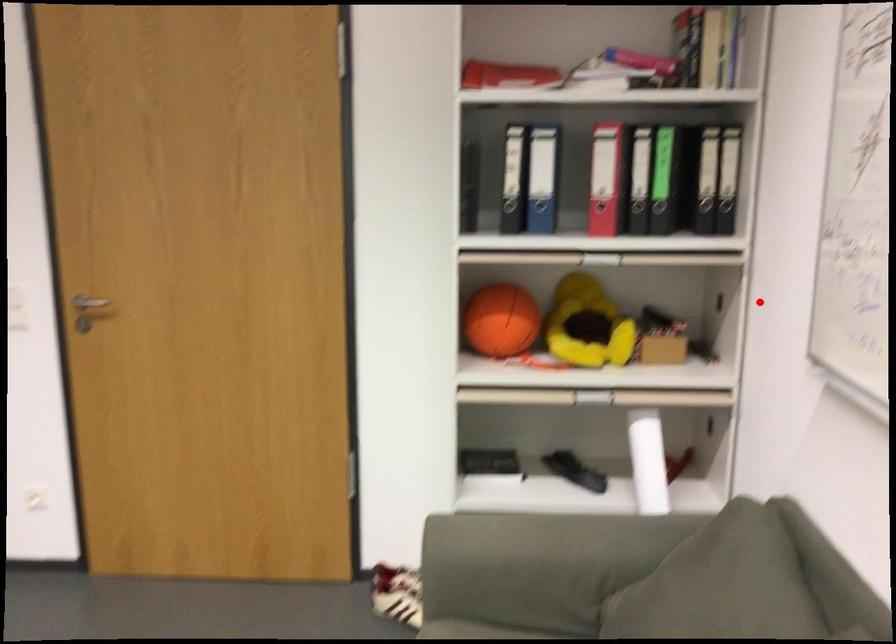
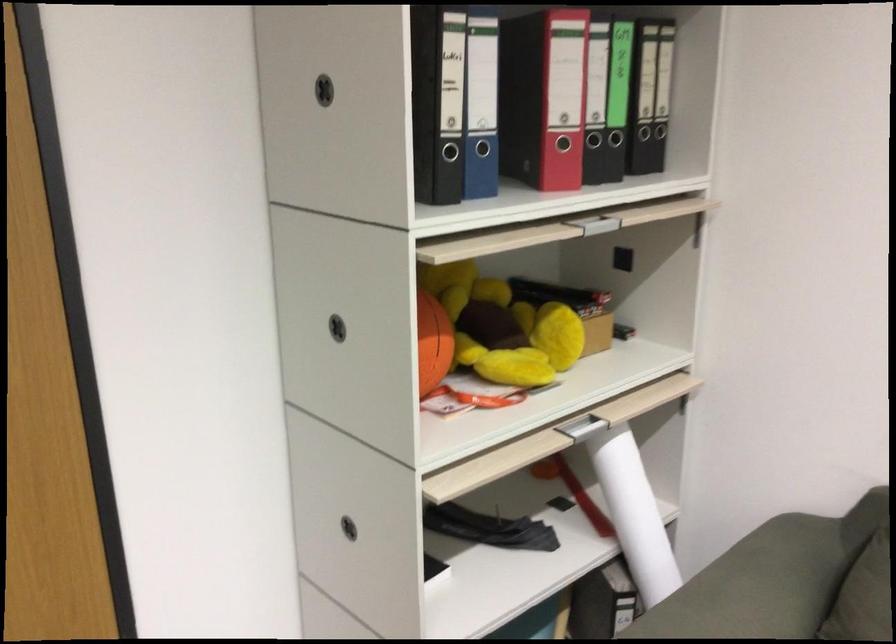
The point at the highlighted location is marked in the first image. Where is the corresponding point in the second image?

(743, 260)